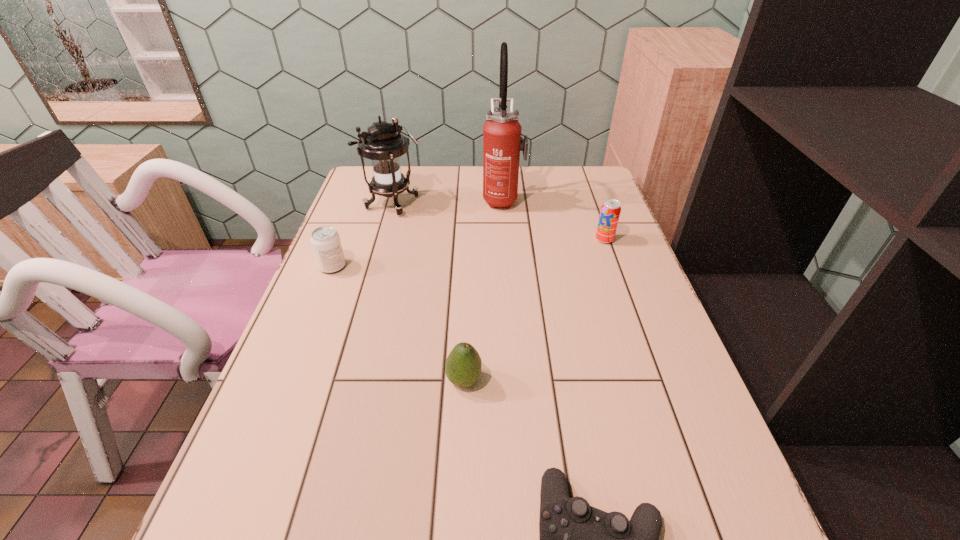
Find the location of `the tallest object`. the tallest object is located at coordinates (502, 142).

You are a GUI agent. You are given a task and a screenshot of the screen. Output one action in this format:
    pyautogui.click(x=<x>, y=<y>)
    Task: Click on the lantern
    The width and height of the screenshot is (960, 540).
    Given the screenshot: What is the action you would take?
    pyautogui.click(x=383, y=143)

Identify the location of the right soda can. The image size is (960, 540). (610, 211).

The height and width of the screenshot is (540, 960). In order to click on the rightmost object in this screenshot , I will do click(610, 211).

What are the coordinates of `the left soda can` in the screenshot? It's located at (325, 240).

This screenshot has width=960, height=540. I want to click on the fourth farthest object, so click(325, 240).

The height and width of the screenshot is (540, 960). Identify the location of the third object from left to right. (463, 365).

Image resolution: width=960 pixels, height=540 pixels. What are the coordinates of `avocado` in the screenshot? It's located at (463, 365).

Image resolution: width=960 pixels, height=540 pixels. Find the location of `vacant space located at the nozzle of the fire extinguisher`. vacant space located at the nozzle of the fire extinguisher is located at coordinates (380, 199).

I want to click on vacant region located 0.120m at the nozzle of the fire extinguisher, so click(445, 199).